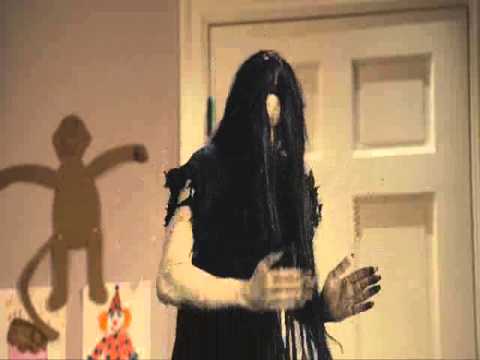
What are the coordinates of `handle` in the screenshot? It's located at (271, 306).